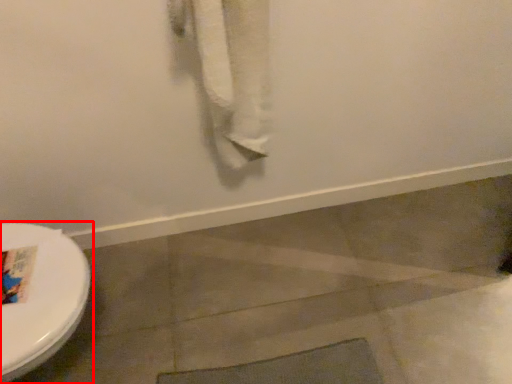
Question: From the image's perspective, where is toilet (annotated by the red box) located in relation to bath towel in the image?

Choices:
 (A) above
 (B) below

Answer: (B)